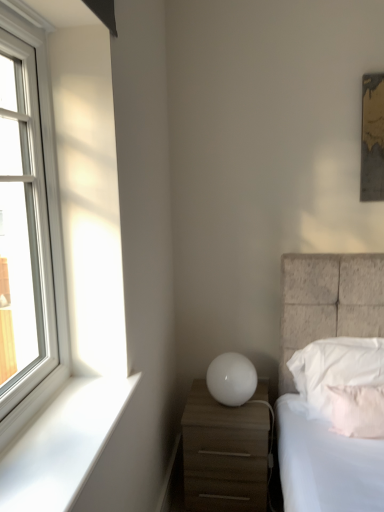
Question: Can you confirm if white glass window at left is positioned to the left of white smooth window sill at lower left?

Choices:
 (A) yes
 (B) no

Answer: (A)

Question: Can you confirm if white glass window at left is wider than white smooth window sill at lower left?

Choices:
 (A) no
 (B) yes

Answer: (A)

Question: Considering the relative sizes of white glass window at left and white smooth window sill at lower left in the image provided, is white glass window at left bigger than white smooth window sill at lower left?

Choices:
 (A) no
 (B) yes

Answer: (B)

Question: From a real-world perspective, is white glass window at left located beneath white smooth window sill at lower left?

Choices:
 (A) yes
 (B) no

Answer: (B)

Question: Can we say white glass window at left lies outside white smooth window sill at lower left?

Choices:
 (A) no
 (B) yes

Answer: (B)

Question: Considering the positions of white matte nightstand at lower right and white soft pillow at right, which is the 2th pillow in front-to-back order, in the image, is white matte nightstand at lower right bigger or smaller than white soft pillow at right, which is the 2th pillow in front-to-back order,?

Choices:
 (A) small
 (B) big

Answer: (B)

Question: Do you think white matte nightstand at lower right is within white soft pillow at right, which is the 2th pillow in front-to-back order, or outside of it?

Choices:
 (A) inside
 (B) outside

Answer: (B)

Question: Is white matte nightstand at lower right wider or thinner than white soft pillow at right, which is the 2th pillow in front-to-back order?

Choices:
 (A) thin
 (B) wide

Answer: (B)

Question: In terms of height, does white matte nightstand at lower right look taller or shorter compared to white soft pillow at right, the first pillow when ordered from back to front?

Choices:
 (A) short
 (B) tall

Answer: (B)

Question: Is white soft pillow at right, which is the 2th pillow in front-to-back order, wider or thinner than white smooth window sill at lower left?

Choices:
 (A) thin
 (B) wide

Answer: (A)

Question: Is white soft pillow at right, the first pillow when ordered from back to front, spatially inside white smooth window sill at lower left, or outside of it?

Choices:
 (A) inside
 (B) outside

Answer: (B)

Question: From a real-world perspective, is white soft pillow at right, which is the 2th pillow in front-to-back order, physically located above or below white smooth window sill at lower left?

Choices:
 (A) below
 (B) above

Answer: (A)

Question: In terms of size, does white soft pillow at right, which is the 2th pillow in front-to-back order, appear bigger or smaller than white smooth window sill at lower left?

Choices:
 (A) small
 (B) big

Answer: (B)

Question: Considering the positions of white soft pillow at right, the first pillow when ordered from back to front, and white matte nightstand at lower right in the image, is white soft pillow at right, the first pillow when ordered from back to front, taller or shorter than white matte nightstand at lower right?

Choices:
 (A) short
 (B) tall

Answer: (A)

Question: From a real-world perspective, is white soft pillow at right, the first pillow when ordered from back to front, above or below white matte nightstand at lower right?

Choices:
 (A) below
 (B) above

Answer: (B)